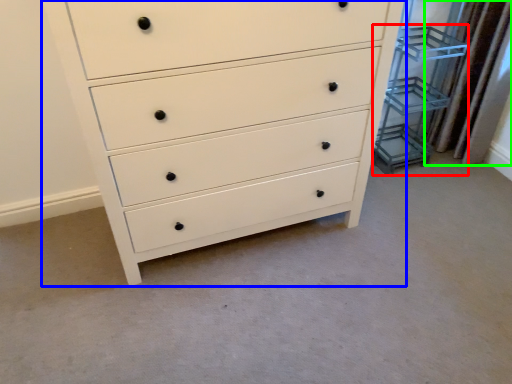
Question: Which is farther away from cabinet (highlighted by a red box)? chest of drawers (highlighted by a blue box) or curtain (highlighted by a green box)?

Choices:
 (A) chest of drawers
 (B) curtain

Answer: (A)